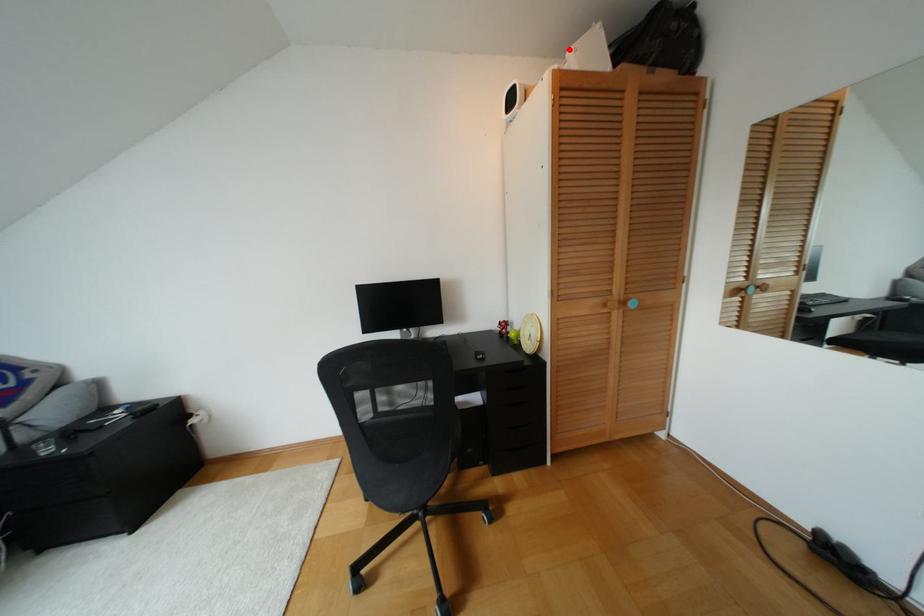
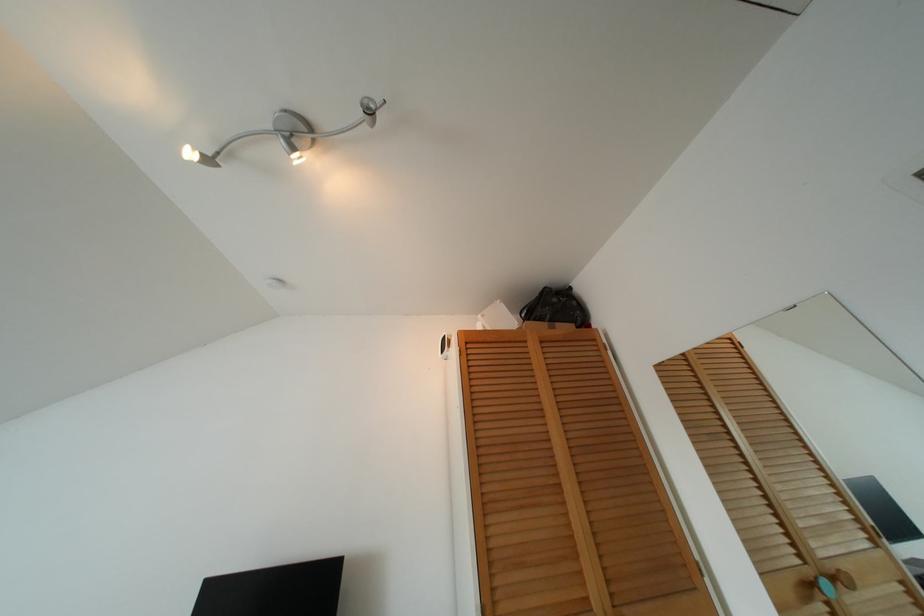
Where in the second image is the point corresponding to the highlighted location from the first image?

(479, 315)